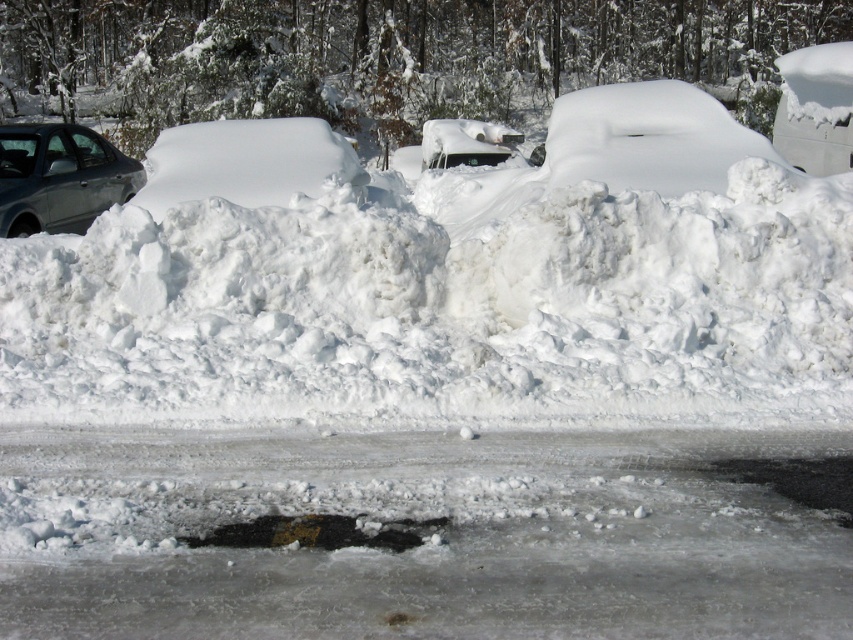
You are a snow removal worker trying to clear the snow from the matte gray sedan at left and the white glossy car at center. Which car requires more effort to clear the snow due to its larger size?

The white glossy car at center requires more effort to clear the snow because it has a greater width than the matte gray sedan at left.

You are a snowplow operator trying to clear the snow from the road. You see the matte gray sedan at left and the white glossy car at center. Which car should you clear first if you need to start from the left side of the road?

You should start by clearing the matte gray sedan at left first since it is positioned on the left side of the white glossy car at center, so starting from the left side of the road would logically begin with the matte gray sedan at left.